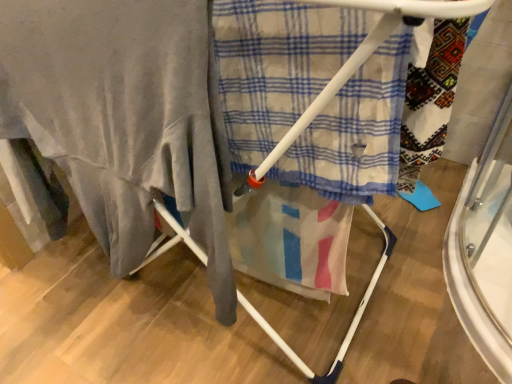
What is the approximate height of white plastic drying rack at center?

It is 35.18 inches.

This screenshot has height=384, width=512. Identify the location of white plastic drying rack at center. (364, 58).

Find the location of `cloth above the matte gray blanket at left (from a real-world perspective)`. cloth above the matte gray blanket at left (from a real-world perspective) is located at coordinates (276, 66).

Is plaid fabric at center to the left of matte gray blanket at left from the viewer's perspective?

No, plaid fabric at center is not to the left of matte gray blanket at left.

From the image's perspective, between plaid fabric at center and matte gray blanket at left, which one is located above?

plaid fabric at center is shown above in the image.

Locate an element on the screen. blanket on the left of white plastic drying rack at center is located at coordinates click(x=121, y=117).

Which of these two, white plastic drying rack at center or matte gray blanket at left, is smaller?

matte gray blanket at left is smaller.

Does white plastic drying rack at center contain matte gray blanket at left?

Yes, matte gray blanket at left is inside white plastic drying rack at center.

Is plaid fabric at center taller than white plastic drying rack at center?

Incorrect, the height of plaid fabric at center is not larger of that of white plastic drying rack at center.

Which is further, (320, 91) or (364, 55)?

Point (320, 91)

From the image's perspective, which one is positioned higher, matte gray blanket at left or white plastic drying rack at center?

white plastic drying rack at center appears higher in the image.

Is matte gray blanket at left outside of white plastic drying rack at center?

That's incorrect, matte gray blanket at left is not completely outside white plastic drying rack at center.

Measure the distance from matte gray blanket at left to white plastic drying rack at center.

matte gray blanket at left and white plastic drying rack at center are 8.16 inches apart from each other.

Does matte gray blanket at left appear on the left side of white plastic drying rack at center?

Yes.

Looking at the image, does matte gray blanket at left seem bigger or smaller compared to plaid fabric at center?

Clearly, matte gray blanket at left is larger in size than plaid fabric at center.

Is matte gray blanket at left wider than plaid fabric at center?

Indeed, matte gray blanket at left has a greater width compared to plaid fabric at center.

Is matte gray blanket at left taller than plaid fabric at center?

Yes.

Locate an element on the screen. furniture below the plaid fabric at center (from a real-world perspective) is located at coordinates (364, 58).

How many degrees apart are the facing directions of white plastic drying rack at center and plaid fabric at center?

The angular difference between white plastic drying rack at center and plaid fabric at center is 1.96 degrees.

Is white plastic drying rack at center oriented towards plaid fabric at center?

Yes, white plastic drying rack at center faces towards plaid fabric at center.

Between white plastic drying rack at center and plaid fabric at center, which one has more height?

Standing taller between the two is white plastic drying rack at center.

In the image, there is a matte gray blanket at left. What are the coordinates of `cloth above it (from the image's perspective)` in the screenshot? It's located at (276, 66).

Image resolution: width=512 pixels, height=384 pixels. What are the coordinates of `furniture directly beneath the matte gray blanket at left (from a real-world perspective)` in the screenshot? It's located at (364, 58).

Based on their spatial positions, is white plastic drying rack at center or plaid fabric at center further from matte gray blanket at left?

white plastic drying rack at center is further to matte gray blanket at left.

When comparing their distances from plaid fabric at center, does white plastic drying rack at center or matte gray blanket at left seem further?

Based on the image, matte gray blanket at left appears to be further to plaid fabric at center.

Looking at the image, which one is located closer to white plastic drying rack at center, plaid fabric at center or matte gray blanket at left?

Based on the image, plaid fabric at center appears to be nearer to white plastic drying rack at center.

When comparing their distances from plaid fabric at center, does matte gray blanket at left or white plastic drying rack at center seem closer?

Based on the image, white plastic drying rack at center appears to be nearer to plaid fabric at center.

Estimate the real-world distances between objects in this image. Which object is further from matte gray blanket at left, plaid fabric at center or white plastic drying rack at center?

white plastic drying rack at center is further to matte gray blanket at left.

Considering their positions, is matte gray blanket at left positioned closer to white plastic drying rack at center than plaid fabric at center?

plaid fabric at center is positioned closer to the anchor white plastic drying rack at center.

Where is `furniture between matte gray blanket at left and plaid fabric at center from left to right`? This screenshot has height=384, width=512. furniture between matte gray blanket at left and plaid fabric at center from left to right is located at coordinates (364, 58).